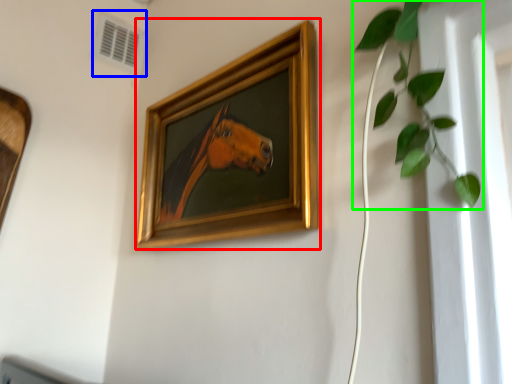
Question: Considering the real-world distances, which object is closest to picture frame (highlighted by a red box)? air conditioning (highlighted by a blue box) or houseplant (highlighted by a green box).

Choices:
 (A) air conditioning
 (B) houseplant

Answer: (B)